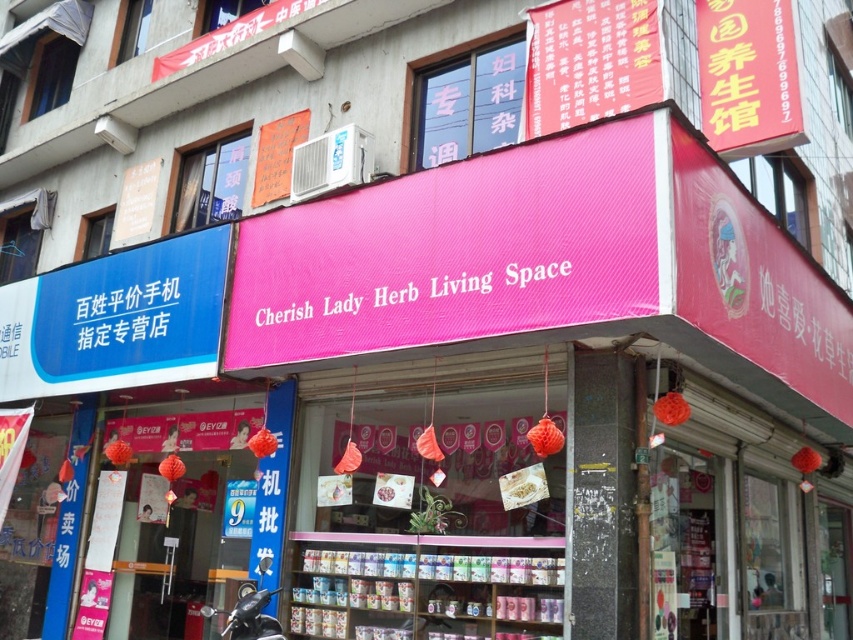
Based on the photo, you are a delivery person who needs to park your motorcycle between the black matte motorcycle at lower left and the whitetext on fabric cherish lady herb living space at center. Can you fit your motorcycle there?

The black matte motorcycle at lower left has a lesser width compared to whitetext on fabric cherish lady herb living space at center, so there is enough space between them to park your motorcycle.

You are a delivery person who needs to park your motorcycle exactly at the point marked by the coordinates given in the description. The motorcycle you are riding is the black matte motorcycle at lower left. Where should you position your motorcycle in relation to the storefront?

The black matte motorcycle at lower left should be positioned at the coordinates point [248,614] as specified in the description.

You are a delivery person standing at the entrance of the commercial area. You need to park your motorcycle so that it doesn not block the entrance. The motorcycle is represented by point (248, 614). Where should you move it to?

The black matte motorcycle at lower left is represented by point (248, 614). To park it without blocking the entrance, move it to a designated parking area away from the storefront entrance.